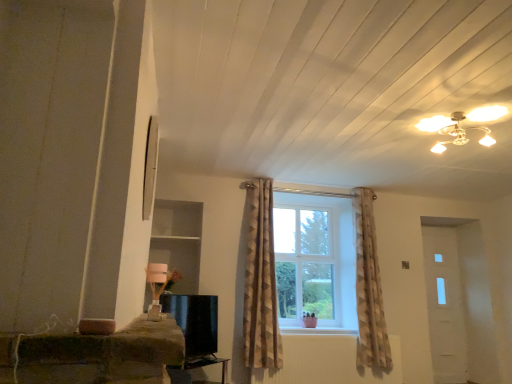
Question: From the image's perspective, relative to black glossy tv stand at lower center, is brown textured curtain at center above or below?

Choices:
 (A) below
 (B) above

Answer: (B)

Question: Would you say brown textured curtain at center is inside or outside black glossy tv stand at lower center?

Choices:
 (A) outside
 (B) inside

Answer: (A)

Question: Which is farther from the black glossy tv stand at lower center?

Choices:
 (A) brown textured curtain at center
 (B) black glossy tv at lower center

Answer: (A)

Question: Estimate the real-world distances between objects in this image. Which object is closer to the black glossy tv at lower center?

Choices:
 (A) brown textured curtain at center
 (B) black glossy tv stand at lower center

Answer: (B)